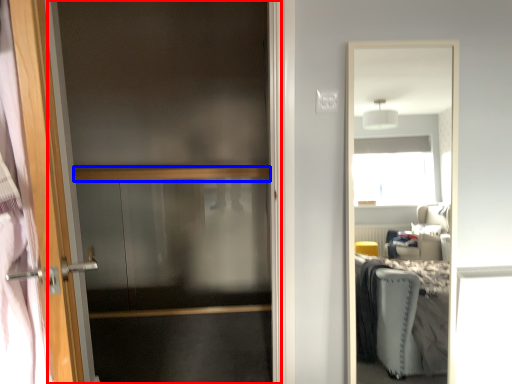
Question: Among these objects, which one is farthest to the camera, screen door (highlighted by a red box) or balustrade (highlighted by a blue box)?

Choices:
 (A) screen door
 (B) balustrade

Answer: (B)